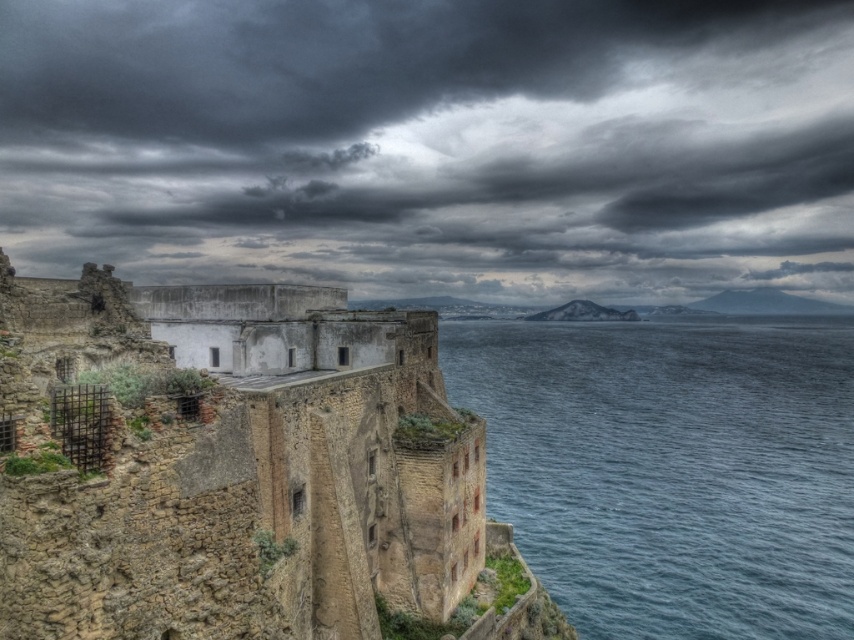
Question: Can you confirm if dark gray cloud at upper center is positioned to the right of blue water at lower right?

Choices:
 (A) no
 (B) yes

Answer: (A)

Question: Estimate the real-world distances between objects in this image. Which object is closer to the brown stone fort at center?

Choices:
 (A) dark gray cloud at upper center
 (B) blue water at lower right

Answer: (B)

Question: Considering the relative positions of dark gray cloud at upper center and blue water at lower right in the image provided, where is dark gray cloud at upper center located with respect to blue water at lower right?

Choices:
 (A) left
 (B) right

Answer: (A)

Question: Which point is closer to the camera taking this photo?

Choices:
 (A) (773, 419)
 (B) (449, 212)

Answer: (A)

Question: Can you confirm if brown stone fort at center is bigger than blue water at lower right?

Choices:
 (A) yes
 (B) no

Answer: (B)

Question: Which point is farther to the camera?

Choices:
 (A) (721, 52)
 (B) (211, 413)
 (C) (588, 600)

Answer: (A)